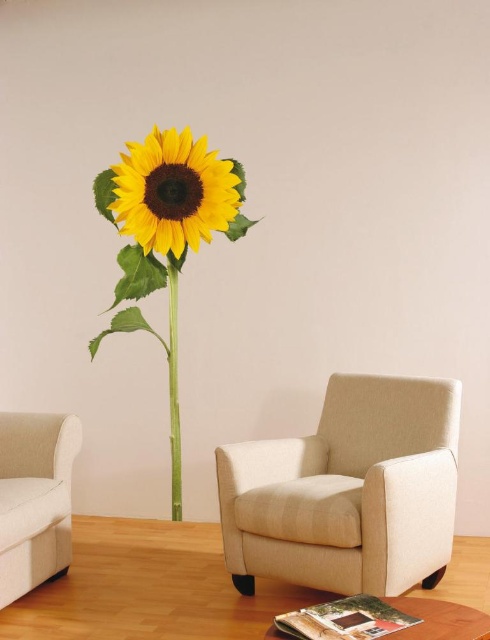
You are a delivery person trying to place a 24 inch wide package between the beige fabric couch at left and the green matte stem at center. Can the package fit in the space between them?

The beige fabric couch at left is 24.34 inches from the green matte stem at center, so the 24 inch wide package can fit in the space between them since it is slightly narrower than the available distance.

You are standing in the center of the room and want to move towards the beige fabric armchair at center. According to the coordinates provided, in which direction should you move to reach it?

The beige fabric armchair at center is located at coordinates point (347,492). Since you are at the center of the room, you should move towards the lower right direction to reach it.

You are an interior designer planning to hang a new picture on the wall. You notice the yellow matte sunflower at upper center and the green matte stem at center. Which object is located above the other?

The yellow matte sunflower at upper center is positioned over the green matte stem at center, so the sunflower is above the stem.